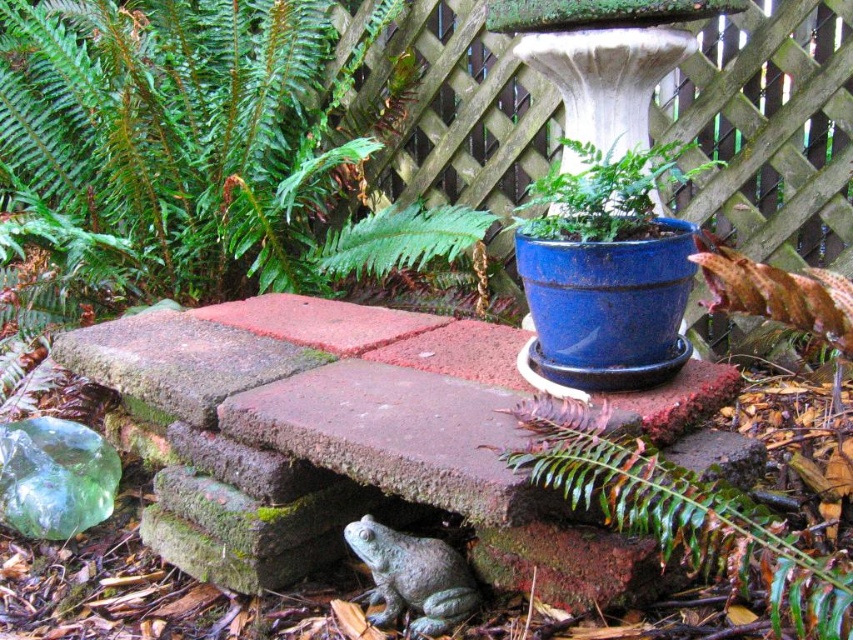
Question: Can you confirm if green leafy fern at lower center is thinner than blue ceramic pot at upper center?

Choices:
 (A) yes
 (B) no

Answer: (A)

Question: Which object is closer to the camera taking this photo?

Choices:
 (A) blue ceramic pot at upper center
 (B) green leafy fern at lower center

Answer: (B)

Question: Does green leafy fern at lower center lie in front of blue ceramic pot at upper center?

Choices:
 (A) yes
 (B) no

Answer: (A)

Question: Is green leafy fern at lower center to the right of blue ceramic pot at upper center from the viewer's perspective?

Choices:
 (A) no
 (B) yes

Answer: (A)